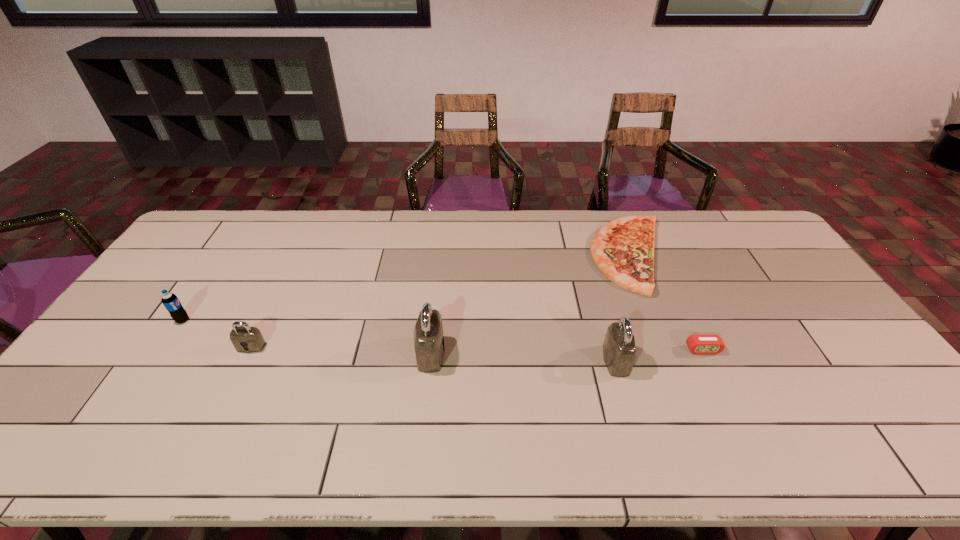
Considering the uniform spacing of padlocks, where should an additional padlock be positioned on the right? Please locate a free spot. Please provide its 2D coordinates. Your answer should be formatted as a tuple, i.e. [(x, y)], where the tuple contains the x and y coordinates of a point satisfying the conditions above.

[(806, 367)]